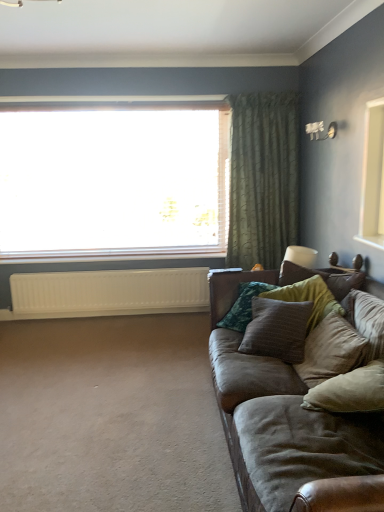
Question: From the image's perspective, does transparent glass window at upper center appear lower than green textured curtain at upper right?

Choices:
 (A) no
 (B) yes

Answer: (A)

Question: Is transparent glass window at upper center wider than green textured curtain at upper right?

Choices:
 (A) no
 (B) yes

Answer: (A)

Question: Does transparent glass window at upper center have a lesser height compared to green textured curtain at upper right?

Choices:
 (A) no
 (B) yes

Answer: (B)

Question: Is transparent glass window at upper center completely or partially outside of green textured curtain at upper right?

Choices:
 (A) yes
 (B) no

Answer: (A)

Question: Is transparent glass window at upper center taller than green textured curtain at upper right?

Choices:
 (A) yes
 (B) no

Answer: (B)

Question: Is transparent glass window at upper center inside the boundaries of white matte radiator at lower left, or outside?

Choices:
 (A) inside
 (B) outside

Answer: (B)

Question: From the image's perspective, is transparent glass window at upper center located above or below white matte radiator at lower left?

Choices:
 (A) above
 (B) below

Answer: (A)

Question: Is point (208, 141) positioned closer to the camera than point (49, 274)?

Choices:
 (A) farther
 (B) closer

Answer: (A)

Question: Is transparent glass window at upper center wider or thinner than white matte radiator at lower left?

Choices:
 (A) wide
 (B) thin

Answer: (A)

Question: Is point (316, 309) positioned closer to the camera than point (87, 288)?

Choices:
 (A) closer
 (B) farther

Answer: (A)

Question: Is textured brown pillow at right, which is counted as the 3th pillow, starting from the front, to the left or to the right of white matte radiator at lower left in the image?

Choices:
 (A) left
 (B) right

Answer: (B)

Question: Considering the positions of textured brown pillow at right, which is counted as the 3th pillow, starting from the front, and white matte radiator at lower left in the image, is textured brown pillow at right, which is counted as the 3th pillow, starting from the front, bigger or smaller than white matte radiator at lower left?

Choices:
 (A) big
 (B) small

Answer: (B)

Question: Looking at their shapes, would you say textured brown pillow at right, arranged as the 1th pillow when viewed from the back, is wider or thinner than white matte radiator at lower left?

Choices:
 (A) wide
 (B) thin

Answer: (A)

Question: From a real-world perspective, is velvet beige pillow at right, arranged as the second pillow when viewed from the front, physically located above or below beige fabric pillow at lower right, the 1th pillow in the front-to-back sequence?

Choices:
 (A) above
 (B) below

Answer: (A)

Question: From the image's perspective, is velvet beige pillow at right, arranged as the second pillow when viewed from the front, positioned above or below beige fabric pillow at lower right, the 1th pillow in the front-to-back sequence?

Choices:
 (A) above
 (B) below

Answer: (A)